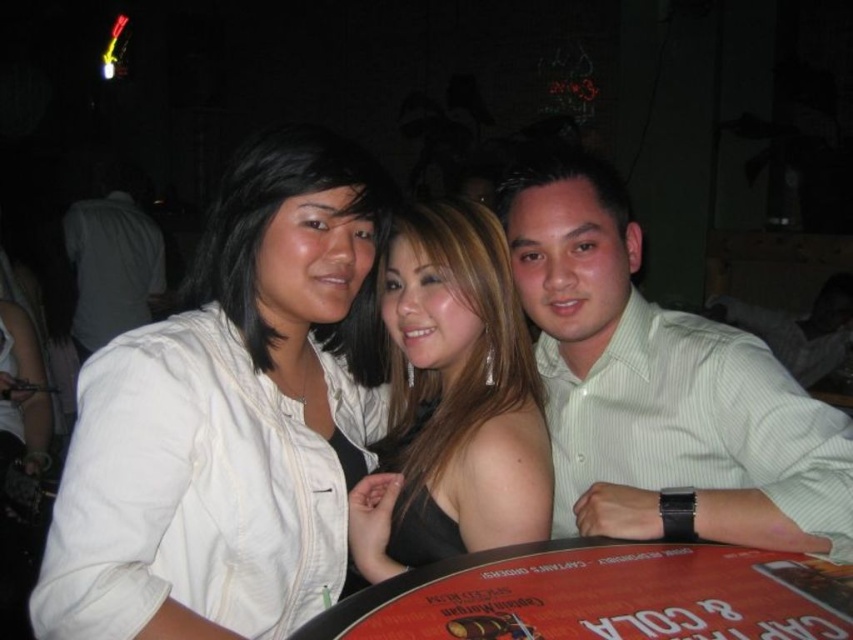
Question: Does shiny black dress at center come in front of wooden table at center?

Choices:
 (A) yes
 (B) no

Answer: (B)

Question: Observing the image, what is the correct spatial positioning of green striped shirt at right in reference to white shirt at left?

Choices:
 (A) right
 (B) left

Answer: (A)

Question: Which point is farther to the camera?

Choices:
 (A) (817, 429)
 (B) (392, 339)

Answer: (B)

Question: Is shiny black dress at center above white shirt at left?

Choices:
 (A) yes
 (B) no

Answer: (B)

Question: Based on their relative distances, which object is nearer to the white matte jacket at upper left?

Choices:
 (A) wooden table at center
 (B) white shirt at left
 (C) green striped shirt at right
 (D) shiny black dress at center

Answer: (D)

Question: Which of the following is the closest to the observer?

Choices:
 (A) green striped shirt at right
 (B) white matte jacket at upper left
 (C) wooden table at center
 (D) white shirt at left

Answer: (C)